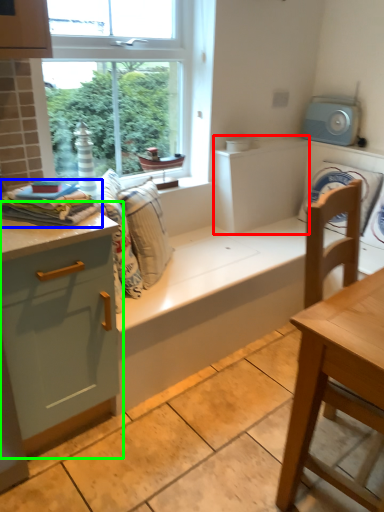
Question: Which is farther away from cabinetry (highlighted by a red box)? material (highlighted by a blue box) or dresser (highlighted by a green box)?

Choices:
 (A) material
 (B) dresser

Answer: (B)